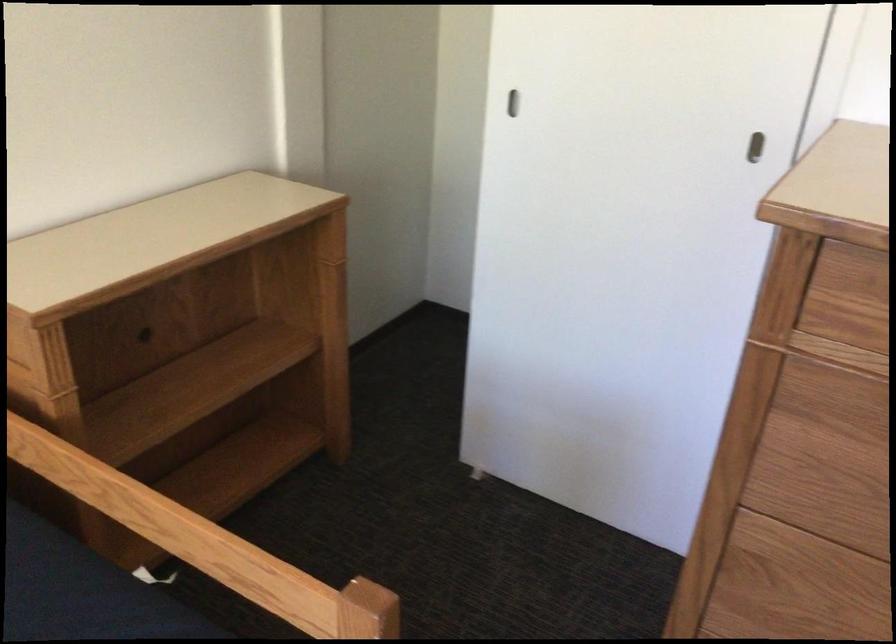
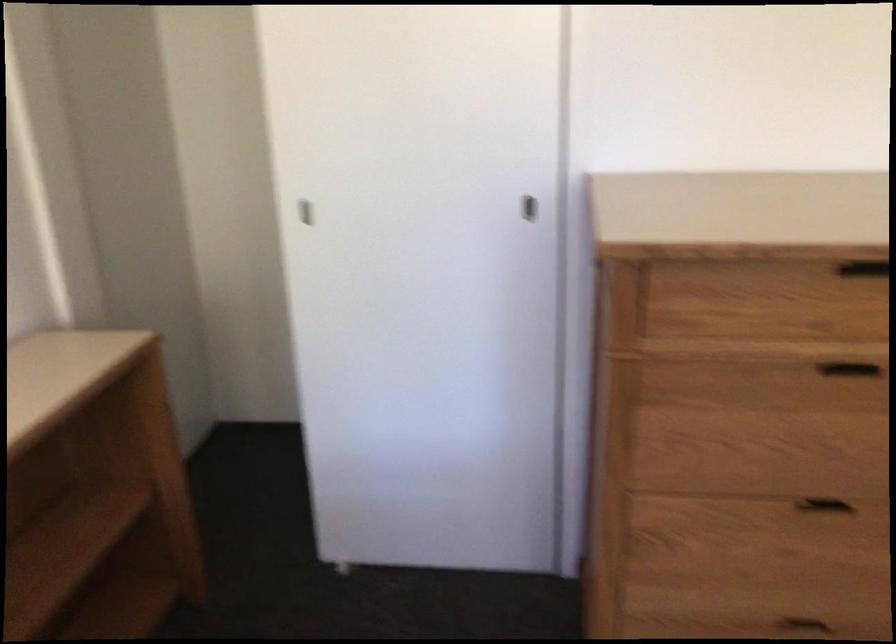
Where in the second image is the point corresponding to (x=513, y=102) from the first image?

(305, 212)